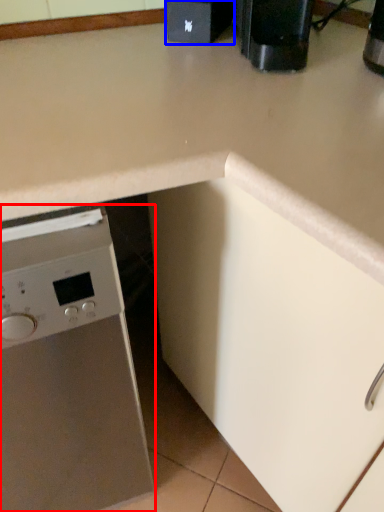
Question: Which object is further to the camera taking this photo, home appliance (highlighted by a red box) or appliance (highlighted by a blue box)?

Choices:
 (A) home appliance
 (B) appliance

Answer: (B)